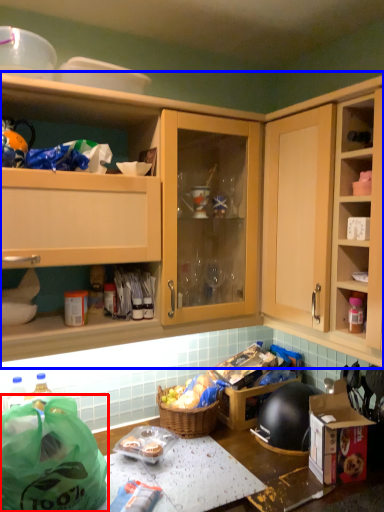
Question: Which of the following is the farthest to the observer, bag (highlighted by a red box) or cabinetry (highlighted by a blue box)?

Choices:
 (A) bag
 (B) cabinetry

Answer: (B)